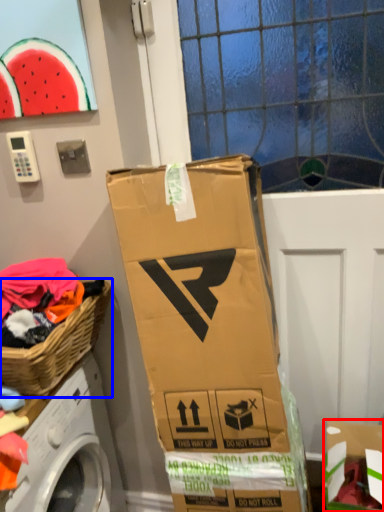
Question: Which object is further to the camera taking this photo, cardboard box (highlighted by a red box) or picnic basket (highlighted by a blue box)?

Choices:
 (A) cardboard box
 (B) picnic basket

Answer: (A)